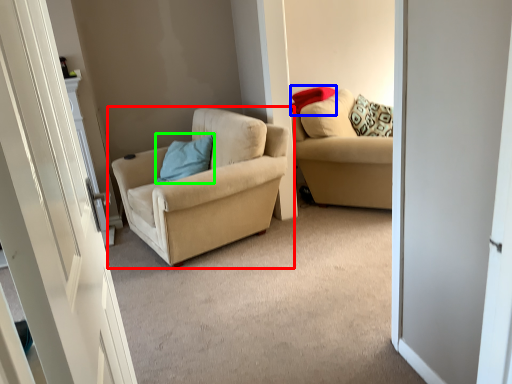
Question: Based on their relative distances, which object is farther from chair (highlighted by a red box)? Choose from pillow (highlighted by a blue box) and pillow (highlighted by a green box).

Choices:
 (A) pillow
 (B) pillow

Answer: (A)